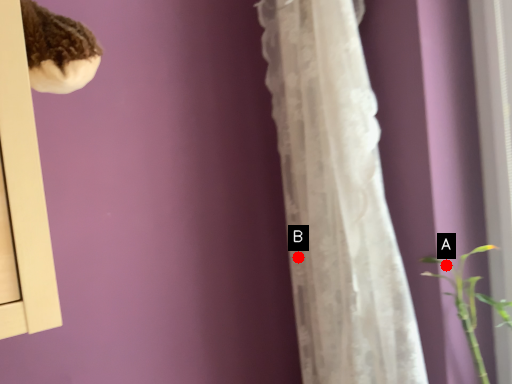
Question: Two points are circled on the image, labeled by A and B beside each circle. Which point is closer to the camera taking this photo?

Choices:
 (A) A is closer
 (B) B is closer

Answer: (A)